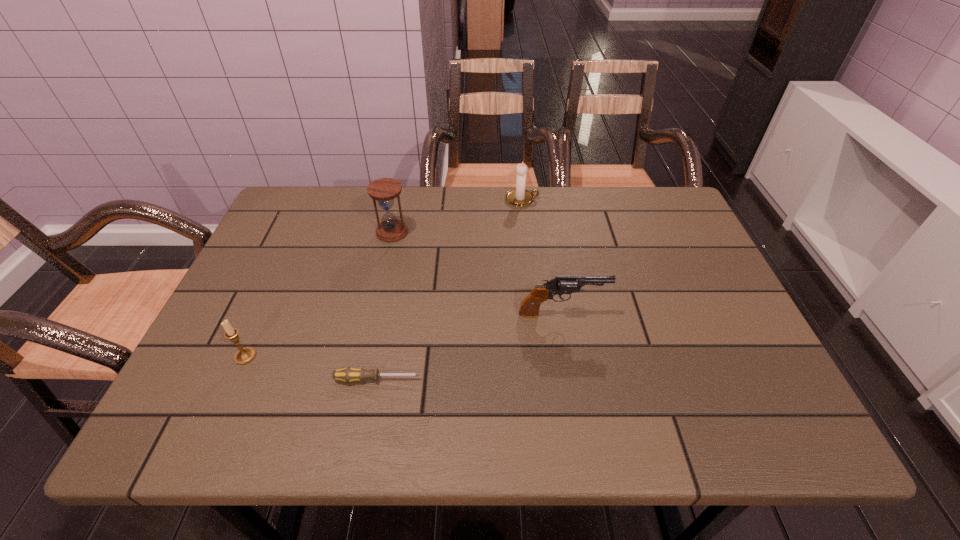
At what (x,y) coordinates should I click in order to perform the action: click on vacant space at the far left corner. Please return your answer as a coordinate pair (x, y). Image resolution: width=960 pixels, height=540 pixels. Looking at the image, I should click on (278, 211).

In the image, there is a desktop. Identify the location of vacant space at the far right corner. (623, 191).

Where is `free point between the gun and the fourth nearest object`? free point between the gun and the fourth nearest object is located at coordinates (477, 273).

Locate an element on the screen. empty space between the second nearest object and the right candle holder is located at coordinates (384, 278).

The width and height of the screenshot is (960, 540). I want to click on vacant area that lies between the nearest object and the fourth nearest object, so click(385, 306).

The image size is (960, 540). I want to click on vacant area between the farther candle holder and the third nearest object, so click(x=542, y=256).

In order to click on free area in between the nearest object and the leftmost object in this screenshot , I will do tap(312, 368).

Image resolution: width=960 pixels, height=540 pixels. Find the location of `vacant area that lies between the farther candle holder and the leftmost object`. vacant area that lies between the farther candle holder and the leftmost object is located at coordinates (384, 278).

Where is `vacant area between the hourglass and the shortest object`? This screenshot has width=960, height=540. vacant area between the hourglass and the shortest object is located at coordinates (385, 306).

At what (x,y) coordinates should I click in order to perform the action: click on free point between the fourth nearest object and the gun. Please return your answer as a coordinate pair (x, y). Looking at the image, I should click on (477, 273).